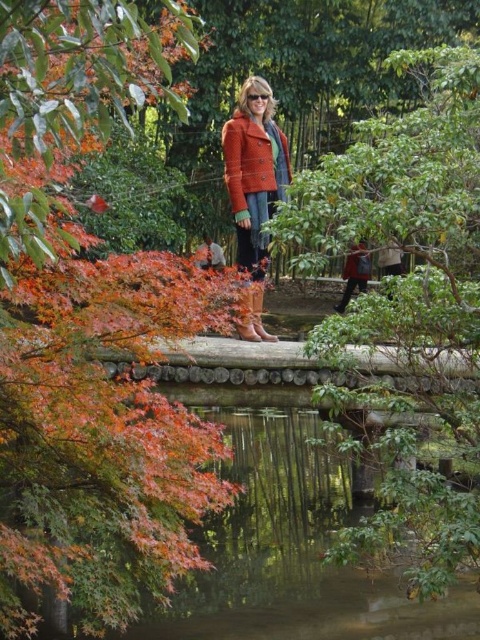
Is smooth reflective water at center positioned at the back of light brown leather boots at center?

No.

Does point (370, 605) lie in front of point (217, 268)?

Yes, it is in front of point (217, 268).

The width and height of the screenshot is (480, 640). Identify the location of smooth reflective water at center. tap(292, 550).

Consider the image. Can you confirm if smooth reflective water at center is positioned above brown suede boot at center?

Incorrect, smooth reflective water at center is not positioned above brown suede boot at center.

Between point (212, 609) and point (263, 298), which one is positioned behind?

The point (263, 298) is more distant.

This screenshot has height=640, width=480. In order to click on smooth reflective water at center in this screenshot , I will do `click(292, 550)`.

Can you confirm if brown leather boot at center is positioned below brown suede boot at center?

Yes, brown leather boot at center is below brown suede boot at center.

Is the position of brown leather boot at center more distant than that of brown suede boot at center?

No, it is not.

Is point (239, 328) less distant than point (255, 324)?

Yes, it is.

Where is `brown leather boot at center`? The image size is (480, 640). brown leather boot at center is located at coordinates (251, 312).